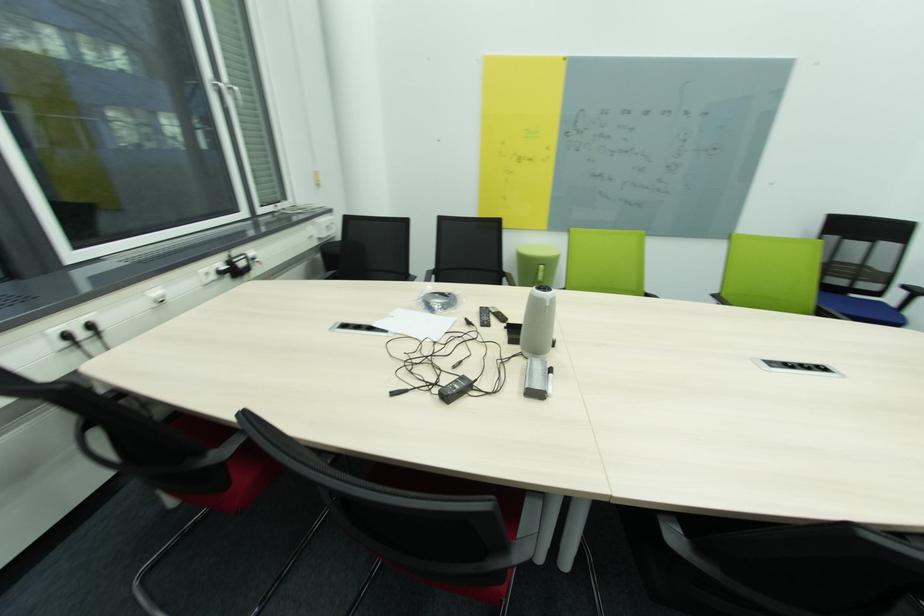
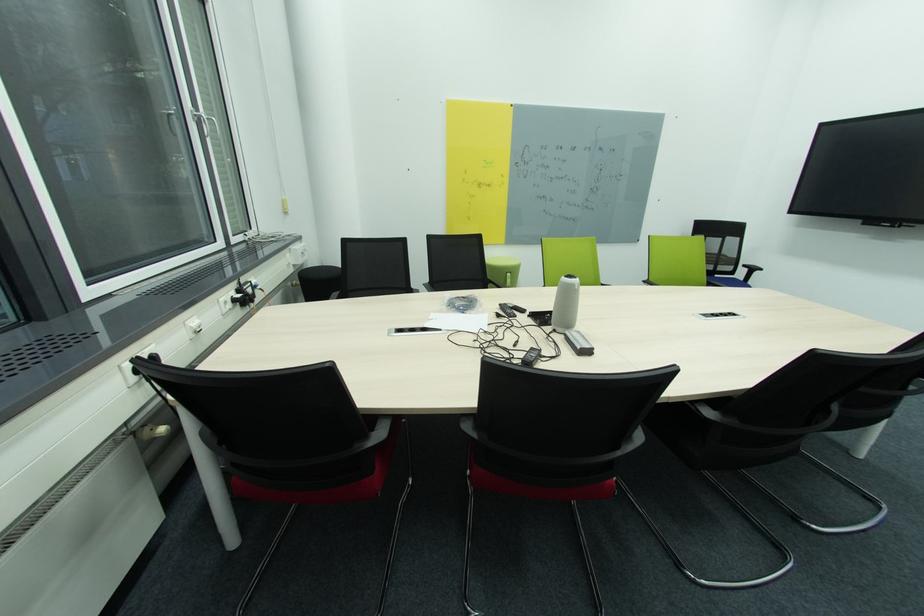
Find the pixel in the second image that matches pixel 541 387 in the first image.

(591, 347)